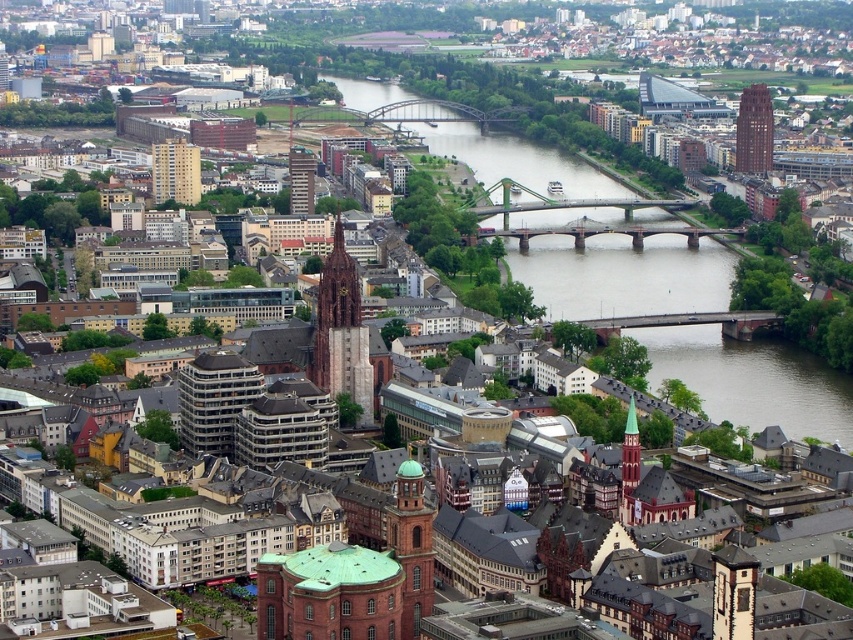
Question: Which object is the closest to the light brown concrete building at center-left?

Choices:
 (A) metallic glass tower at center
 (B) glassy reflective skyscraper at upper right

Answer: (A)

Question: Where is glassy reflective skyscraper at upper right located in relation to greenish-brown stone church steeple at center-right in the image?

Choices:
 (A) left
 (B) right

Answer: (B)

Question: Which object is the closest to the glassy reflective skyscraper at upper right?

Choices:
 (A) greenish-brown stone church steeple at center-right
 (B) brown stone tower at center
 (C) brown stone bridge at center
 (D) red brick tower at center

Answer: (C)

Question: Is red brick tower at center behind glassy reflective skyscraper at upper right?

Choices:
 (A) yes
 (B) no

Answer: (B)

Question: Where is brown stone tower at center located in relation to greenish-brown stone church steeple at center-right in the image?

Choices:
 (A) left
 (B) right

Answer: (A)

Question: Which point is farther to the camera?

Choices:
 (A) (538, 240)
 (B) (753, 161)
 (C) (310, 209)
 (D) (630, 474)

Answer: (B)